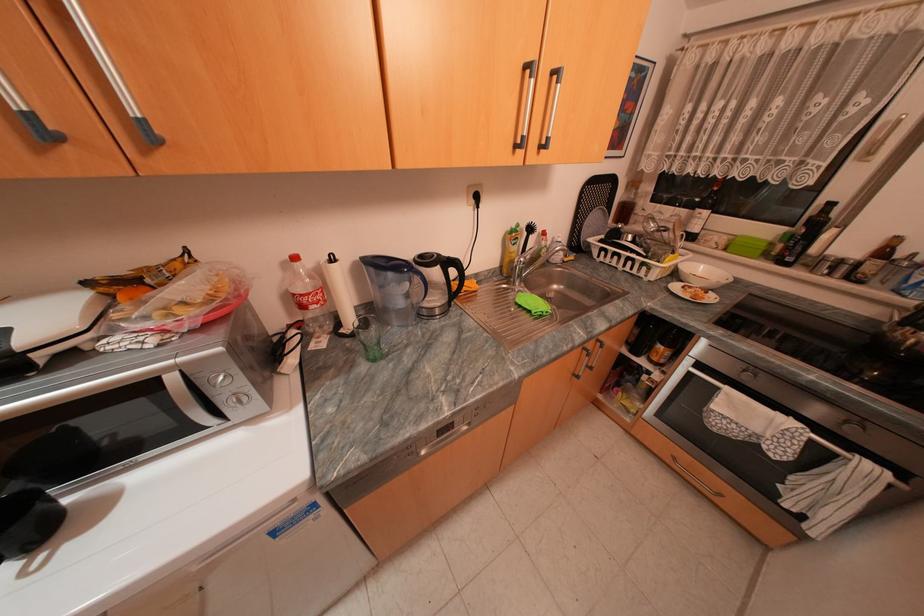
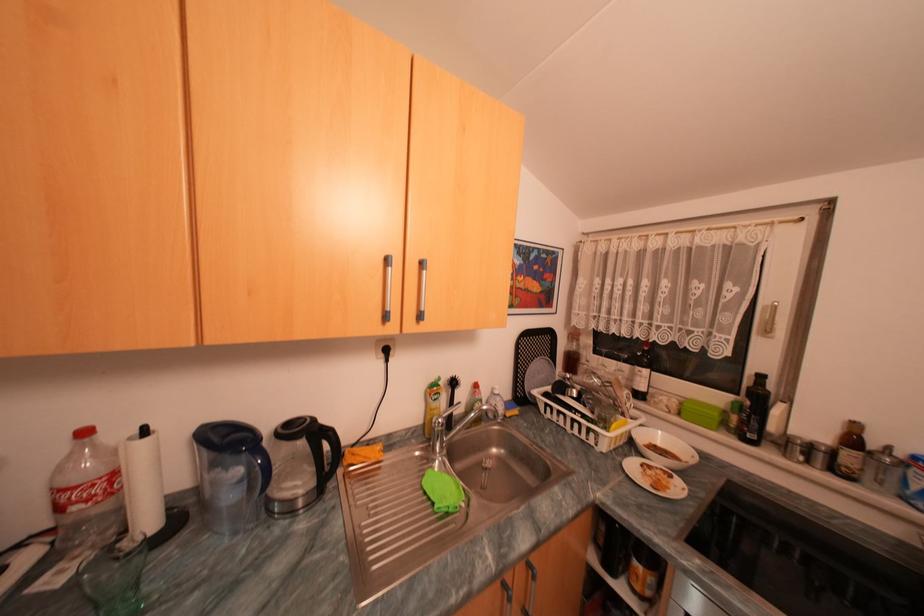
Where in the second image is the point corresponding to point 685,286 from the first image?

(641, 464)